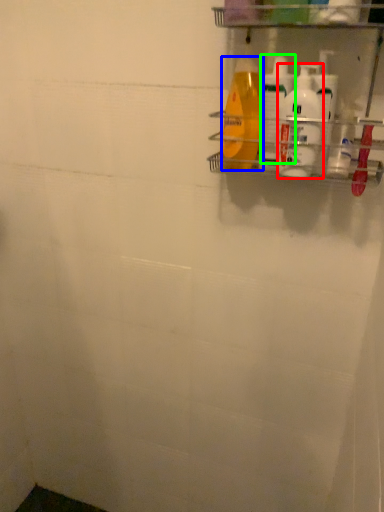
Question: Estimate the real-world distances between objects in this image. Which object is farther from cleaning product (highlighted by a red box), cleaning product (highlighted by a blue box) or cleaning product (highlighted by a green box)?

Choices:
 (A) cleaning product
 (B) cleaning product

Answer: (A)